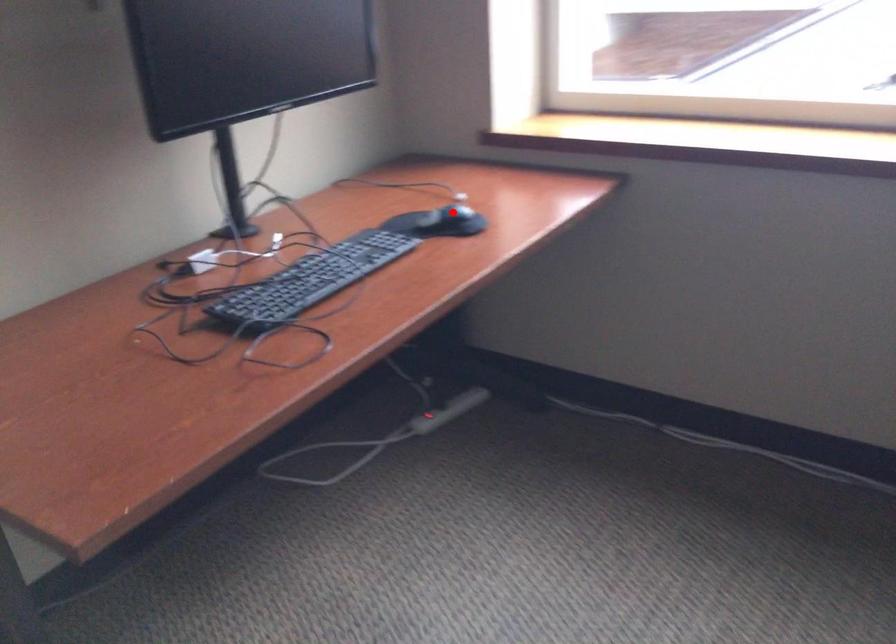
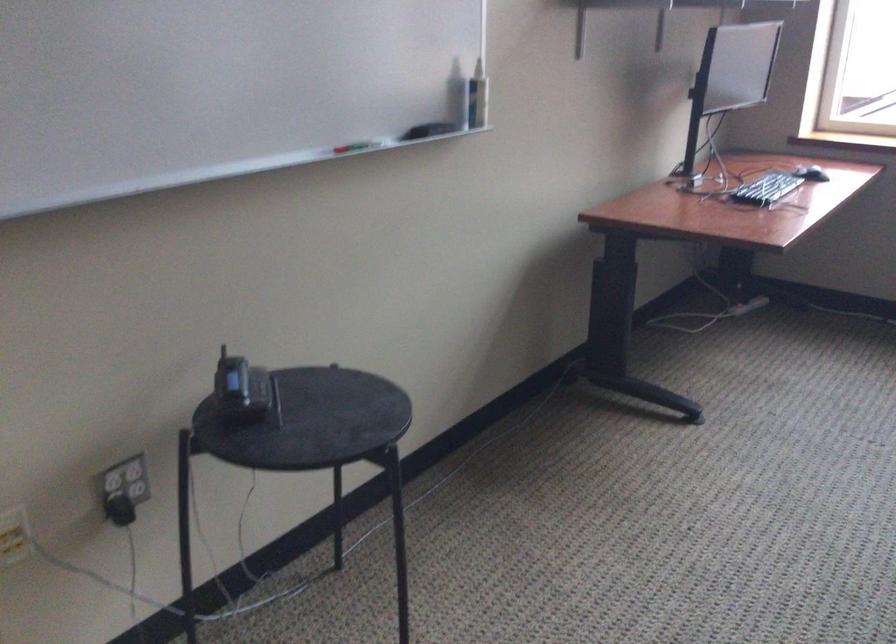
Question: I am providing you with two images of the same scene from different viewpoints. A red point is marked on the first image. Is the red point's position out of view in image 2?

Choices:
 (A) Yes
 (B) No

Answer: (A)